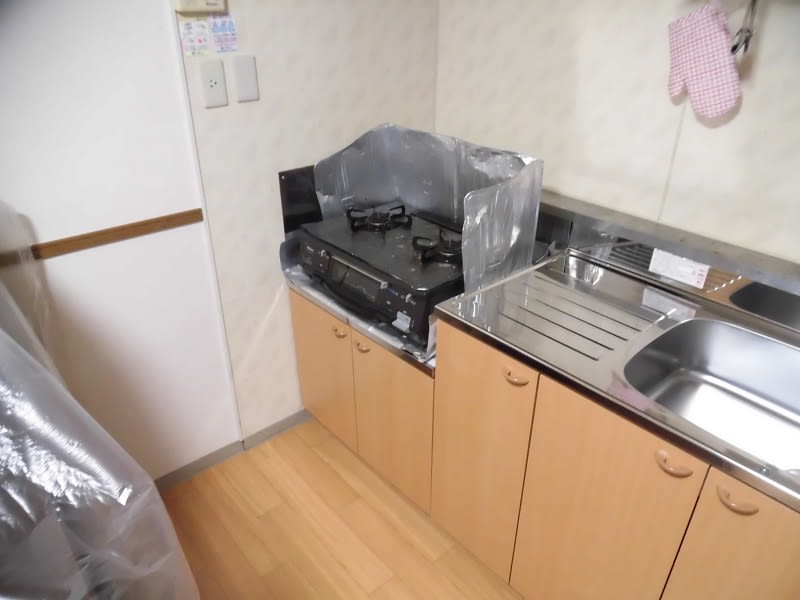
Find the location of a particular element. steel counter is located at coordinates (558, 332).